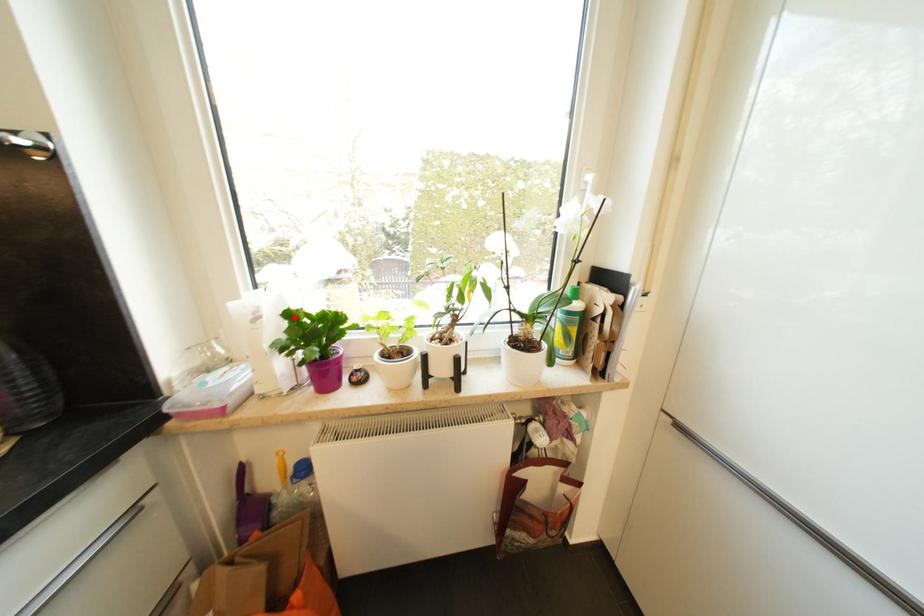
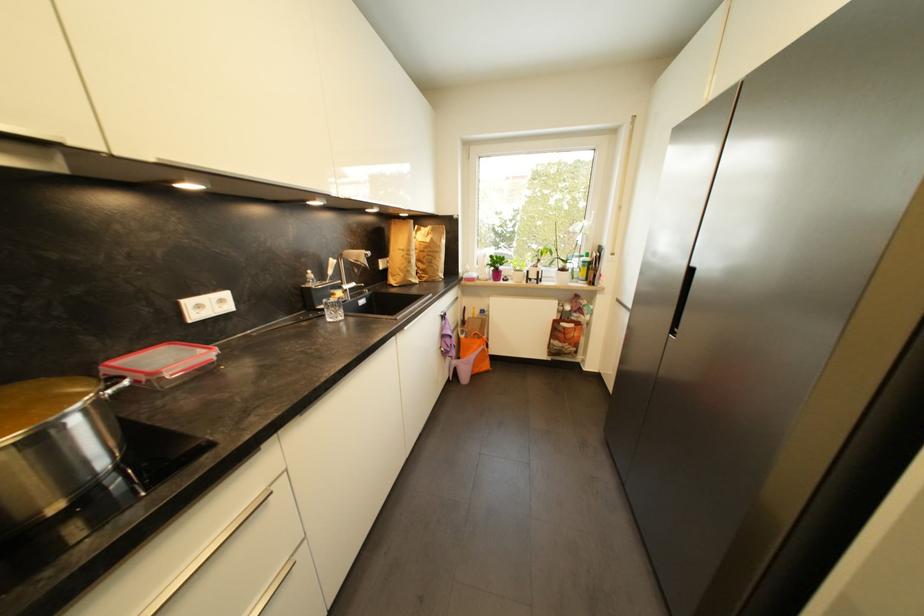
The point at the highlighted location is marked in the first image. Where is the corresponding point in the second image?

(495, 257)